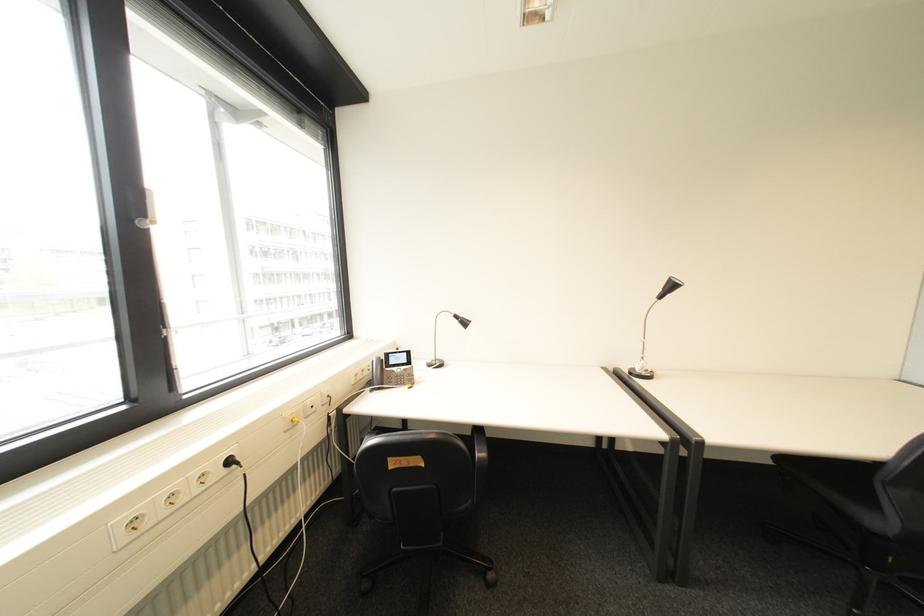
Where would you lift the telephone handset? Please return your answer as a coordinate pair (x, y).

(379, 371)